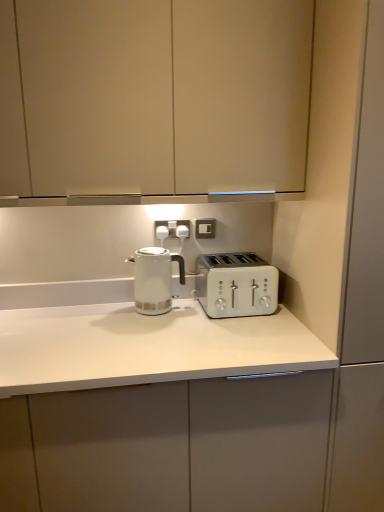
Question: Is the surface of matte white cabinet at upper center, which is the 1th cabinetry in top-to-bottom order, in direct contact with white plastic electrical outlet at center, acting as the 2th electric outlet starting from the right?

Choices:
 (A) yes
 (B) no

Answer: (B)

Question: Is matte white cabinet at upper center, the 2th cabinetry positioned from the bottom, in front of white plastic electrical outlet at center, which is the 1th electric outlet in left-to-right order?

Choices:
 (A) no
 (B) yes

Answer: (B)

Question: From a real-world perspective, does matte white cabinet at upper center, which is the 1th cabinetry in top-to-bottom order, stand above white plastic electrical outlet at center, which is the 1th electric outlet in left-to-right order?

Choices:
 (A) yes
 (B) no

Answer: (A)

Question: From a real-world perspective, is matte white cabinet at upper center, which is the 1th cabinetry in top-to-bottom order, below white plastic electrical outlet at center, which is the 1th electric outlet in left-to-right order?

Choices:
 (A) no
 (B) yes

Answer: (A)

Question: Considering the relative positions of matte white cabinet at upper center, which is the 1th cabinetry in top-to-bottom order, and white plastic electrical outlet at center, acting as the 2th electric outlet starting from the right, in the image provided, is matte white cabinet at upper center, which is the 1th cabinetry in top-to-bottom order, to the left of white plastic electrical outlet at center, acting as the 2th electric outlet starting from the right, from the viewer's perspective?

Choices:
 (A) no
 (B) yes

Answer: (B)

Question: Is matte white cabinet at upper center, which is the 1th cabinetry in top-to-bottom order, wider or thinner than white plastic toaster at center?

Choices:
 (A) wide
 (B) thin

Answer: (A)

Question: Considering the positions of matte white cabinet at upper center, which is the 1th cabinetry in top-to-bottom order, and white plastic toaster at center in the image, is matte white cabinet at upper center, which is the 1th cabinetry in top-to-bottom order, taller or shorter than white plastic toaster at center?

Choices:
 (A) short
 (B) tall

Answer: (B)

Question: Considering the positions of matte white cabinet at upper center, the 2th cabinetry positioned from the bottom, and white plastic toaster at center in the image, is matte white cabinet at upper center, the 2th cabinetry positioned from the bottom, bigger or smaller than white plastic toaster at center?

Choices:
 (A) small
 (B) big

Answer: (B)

Question: From the image's perspective, is matte white cabinet at upper center, which is the 1th cabinetry in top-to-bottom order, positioned above or below white plastic toaster at center?

Choices:
 (A) above
 (B) below

Answer: (A)

Question: From a real-world perspective, is matte white cabinet at upper center, the 2th cabinetry positioned from the bottom, positioned above or below white glossy countertop at center, which is the first cabinetry in bottom-to-top order?

Choices:
 (A) below
 (B) above

Answer: (B)

Question: Considering the positions of point coord(102,86) and point coord(130,406), is point coord(102,86) closer or farther from the camera than point coord(130,406)?

Choices:
 (A) farther
 (B) closer

Answer: (A)

Question: Considering the positions of matte white cabinet at upper center, the 2th cabinetry positioned from the bottom, and white glossy countertop at center, which appears as the second cabinetry when viewed from the top, in the image, is matte white cabinet at upper center, the 2th cabinetry positioned from the bottom, bigger or smaller than white glossy countertop at center, which appears as the second cabinetry when viewed from the top,?

Choices:
 (A) small
 (B) big

Answer: (A)

Question: Considering the relative positions of matte white cabinet at upper center, which is the 1th cabinetry in top-to-bottom order, and white glossy countertop at center, which appears as the second cabinetry when viewed from the top, in the image provided, is matte white cabinet at upper center, which is the 1th cabinetry in top-to-bottom order, to the left or to the right of white glossy countertop at center, which appears as the second cabinetry when viewed from the top,?

Choices:
 (A) left
 (B) right

Answer: (B)

Question: From their relative heights in the image, would you say white plastic toaster at center is taller or shorter than white glossy kettle at center?

Choices:
 (A) short
 (B) tall

Answer: (A)

Question: Looking at their shapes, would you say white plastic toaster at center is wider or thinner than white glossy kettle at center?

Choices:
 (A) wide
 (B) thin

Answer: (A)